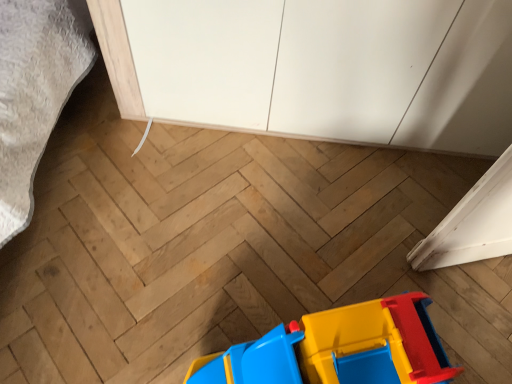
Identify the location of free space in front of white matte cabinet at upper center. The width and height of the screenshot is (512, 384). (288, 235).